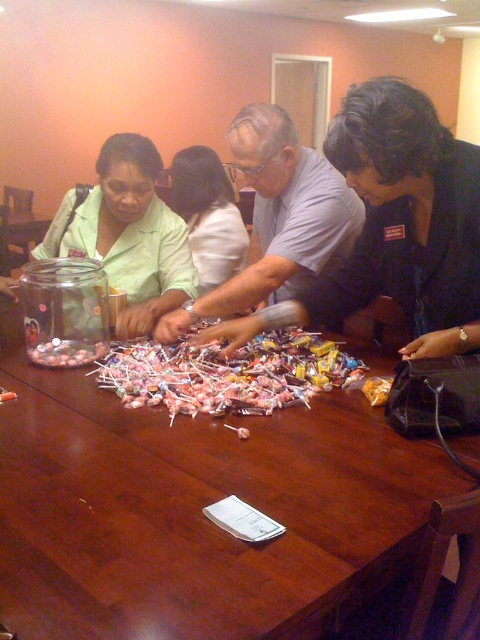
You are standing in front of the table with lollipops and need to reach the point at coordinates point (81,221). If your arm can extend 5 feet, can you reach it?

The point (81,221) is 6.33 feet away from the camera, so you cannot reach it with an arm that extends only 5 feet.

You are a participant in the lollipop sorting activity. You notice the matte green shirt at center and the pink glossy lollipops at center. Which object is positioned higher in the image?

The matte green shirt at center is above the pink glossy lollipops at center, so it is positioned higher in the image.

You are organizing a candy store and need to decide which shirt to use as a promotional display backdrop. Since both the matte green shirt at center and the white fabric shirt at center are available, which one would be more suitable for covering a larger area of the display?

The matte green shirt at center is larger in size than the white fabric shirt at center, so it would be more suitable for covering a larger area of the display.